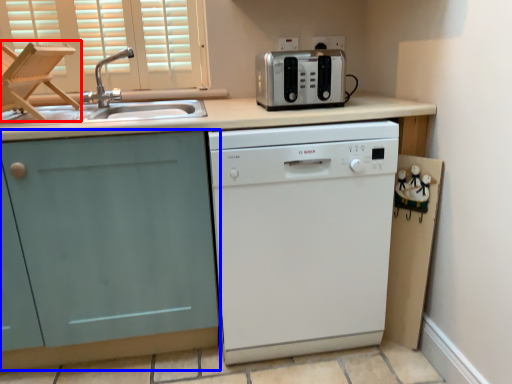
Question: Among these objects, which one is farthest to the camera, folding chair (highlighted by a red box) or cabinetry (highlighted by a blue box)?

Choices:
 (A) folding chair
 (B) cabinetry

Answer: (A)